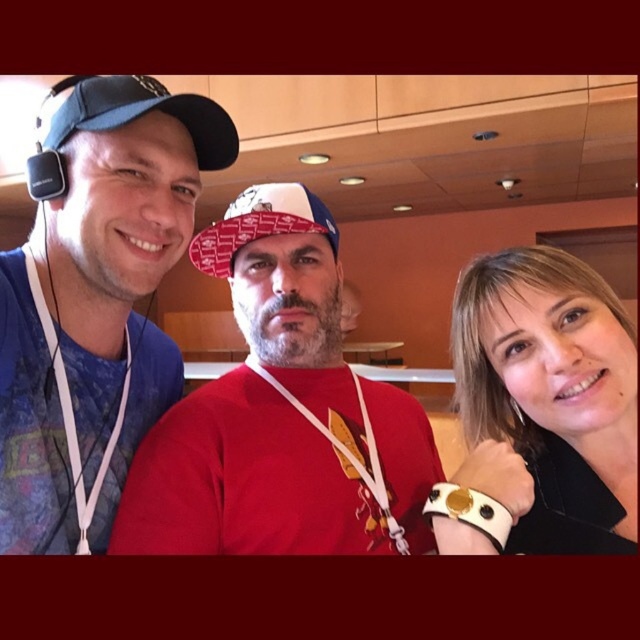
Who is more forward, (67, 388) or (534, 529)?

Point (534, 529)

Does point (129, 442) lie behind point (545, 413)?

Yes.

Does point (52, 541) come closer to viewer compared to point (556, 305)?

No, (52, 541) is behind (556, 305).

What are the coordinates of `blue fabric shirt at left` in the screenshot? It's located at (93, 300).

Is blue fabric shirt at left positioned at the back of blue fabric baseball cap at left?

That is True.

Who is lower down, blue fabric shirt at left or blue fabric baseball cap at left?

Positioned lower is blue fabric shirt at left.

At what (x,y) coordinates should I click in order to perform the action: click on blue fabric shirt at left. Please return your answer as a coordinate pair (x, y). This screenshot has height=640, width=640. Looking at the image, I should click on (93, 300).

Is blue fabric shirt at left thinner than white printed baseball cap at center?

In fact, blue fabric shirt at left might be wider than white printed baseball cap at center.

Looking at this image, can you confirm if blue fabric shirt at left is wider than white printed baseball cap at center?

Yes.

The width and height of the screenshot is (640, 640). What do you see at coordinates (93, 300) in the screenshot?
I see `blue fabric shirt at left` at bounding box center [93, 300].

Identify the location of blue fabric shirt at left. (93, 300).